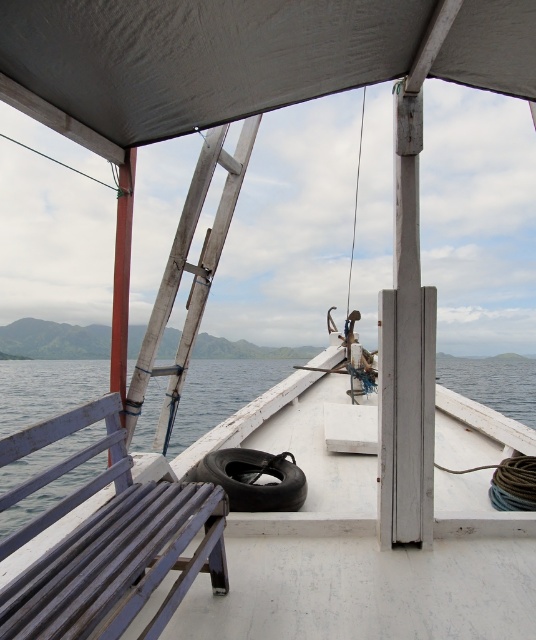
Does point (40, 45) come behind point (167, 276)?

No.

Consider the image. Which of these two, white matte canopy at upper center or wooden textured ladder at center, stands shorter?

white matte canopy at upper center

Is point (470, 72) in front of point (249, 148)?

Yes, point (470, 72) is closer to viewer.

Where is `white matte canopy at upper center`? Image resolution: width=536 pixels, height=640 pixels. white matte canopy at upper center is located at coordinates (241, 58).

Is blue water at lower left to the right of wooden textured ladder at center from the viewer's perspective?

In fact, blue water at lower left is to the left of wooden textured ladder at center.

Between point (72, 385) and point (158, 308), which one is positioned in front?

Point (158, 308)

Where is `blue water at lower left`? The height and width of the screenshot is (640, 536). blue water at lower left is located at coordinates (47, 388).

Does blue water at lower left have a greater width compared to black rubber tire at center?

Yes, blue water at lower left is wider than black rubber tire at center.

Image resolution: width=536 pixels, height=640 pixels. Find the location of `blue water at lower left`. blue water at lower left is located at coordinates (47, 388).

Who is more forward, (73, 476) or (293, 492)?

Point (293, 492)

The height and width of the screenshot is (640, 536). Find the location of `blue water at lower left`. blue water at lower left is located at coordinates (47, 388).